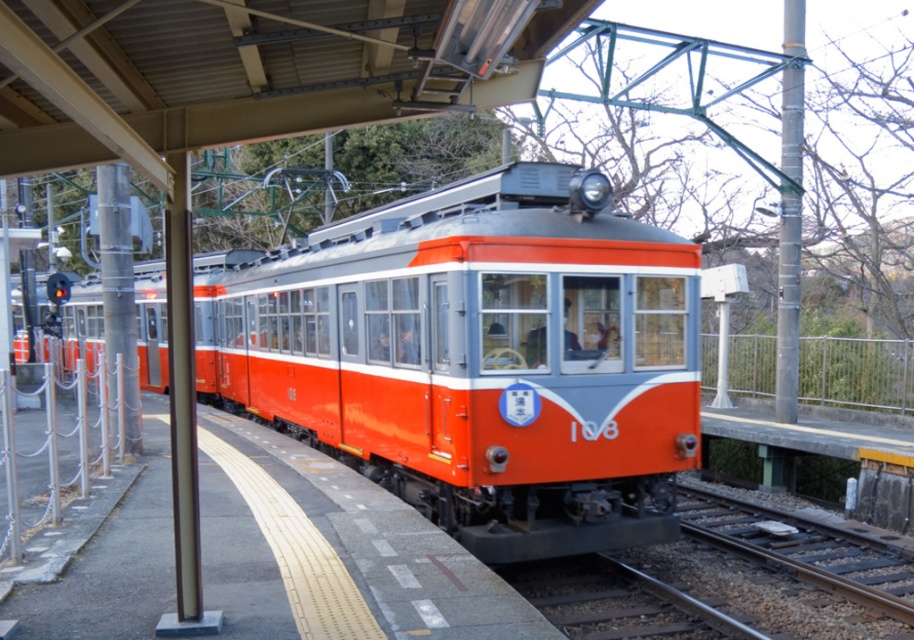
Does point (378, 241) come farther from viewer compared to point (815, 625)?

That is True.

Is matte orange train at center behind smooth metal track at lower center?

No.

Locate an element on the screen. The height and width of the screenshot is (640, 914). matte orange train at center is located at coordinates (477, 356).